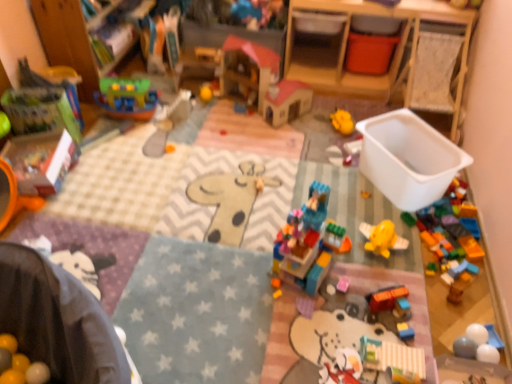
Identify the location of free region under translucent plastic boat at upper left, the seventh toy positioned from the bottom (from a real-world perspective). The image size is (512, 384). pos(130,111).